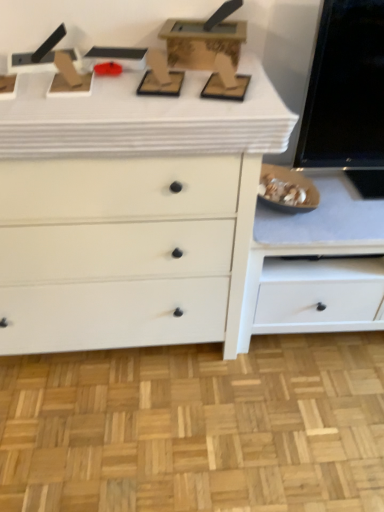
Question: Is white matte counter top at upper center positioned before white matte cabinet at lower right?

Choices:
 (A) yes
 (B) no

Answer: (A)

Question: From a real-world perspective, is white matte counter top at upper center positioned over white matte cabinet at lower right based on gravity?

Choices:
 (A) yes
 (B) no

Answer: (A)

Question: Could you tell me if white matte counter top at upper center is turned towards white matte cabinet at lower right?

Choices:
 (A) no
 (B) yes

Answer: (A)

Question: Is white matte cabinet at lower right inside white matte counter top at upper center?

Choices:
 (A) no
 (B) yes

Answer: (A)

Question: Considering the relative sizes of white matte counter top at upper center and white matte cabinet at lower right in the image provided, is white matte counter top at upper center thinner than white matte cabinet at lower right?

Choices:
 (A) no
 (B) yes

Answer: (A)

Question: In terms of height, does white matte counter top at upper center look taller or shorter compared to white matte chest of drawers at center?

Choices:
 (A) short
 (B) tall

Answer: (A)

Question: In terms of width, does white matte counter top at upper center look wider or thinner when compared to white matte chest of drawers at center?

Choices:
 (A) wide
 (B) thin

Answer: (A)

Question: Considering the positions of point (21, 108) and point (134, 308), is point (21, 108) closer or farther from the camera than point (134, 308)?

Choices:
 (A) closer
 (B) farther

Answer: (A)

Question: From the image's perspective, is white matte counter top at upper center positioned above or below white matte chest of drawers at center?

Choices:
 (A) above
 (B) below

Answer: (A)

Question: In the image, is white matte chest of drawers at center positioned in front of or behind white matte counter top at upper center?

Choices:
 (A) behind
 (B) front

Answer: (A)

Question: In terms of size, does white matte chest of drawers at center appear bigger or smaller than white matte counter top at upper center?

Choices:
 (A) big
 (B) small

Answer: (A)

Question: Is point (167, 152) closer or farther from the camera than point (263, 125)?

Choices:
 (A) farther
 (B) closer

Answer: (A)

Question: Would you say white matte chest of drawers at center is to the left or to the right of white matte counter top at upper center in the picture?

Choices:
 (A) left
 (B) right

Answer: (A)

Question: Relative to white matte chest of drawers at center, is white matte cabinet at lower right in front or behind?

Choices:
 (A) behind
 (B) front

Answer: (A)

Question: Is white matte cabinet at lower right spatially inside white matte chest of drawers at center, or outside of it?

Choices:
 (A) inside
 (B) outside

Answer: (B)